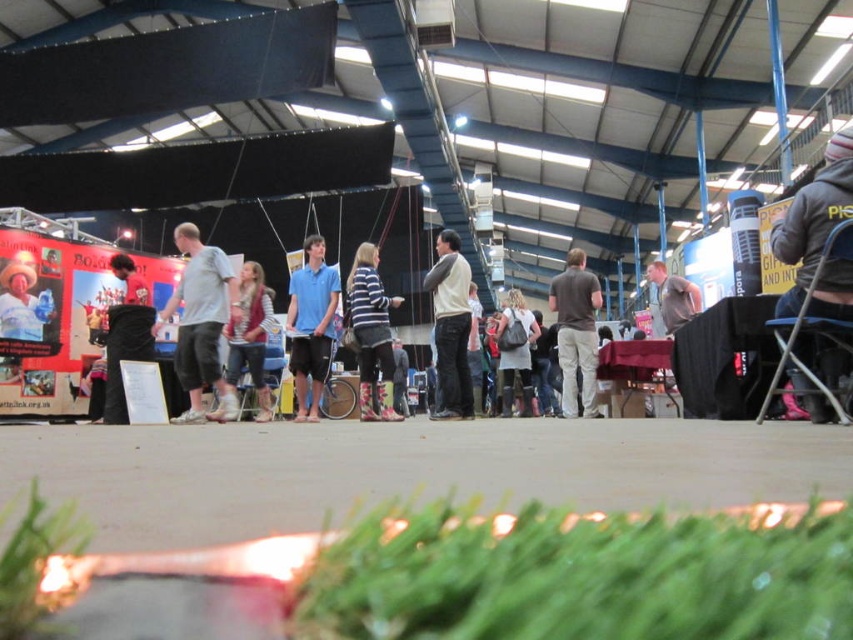
Can you confirm if green fuzzy grass at lower center is positioned to the right of green leafy grass at lower left?

Indeed, green fuzzy grass at lower center is positioned on the right side of green leafy grass at lower left.

Who is shorter, green fuzzy grass at lower center or green leafy grass at lower left?

green fuzzy grass at lower center

Does point (486, 561) lie behind point (47, 557)?

No, it is not.

Locate an element on the screen. green fuzzy grass at lower center is located at coordinates (582, 576).

Which is above, green fuzzy grass at lower center or matte black poster at left?

matte black poster at left is higher up.

Is green fuzzy grass at lower center thinner than matte black poster at left?

Incorrect, green fuzzy grass at lower center's width is not less than matte black poster at left's.

What do you see at coordinates (582, 576) in the screenshot? This screenshot has width=853, height=640. I see `green fuzzy grass at lower center` at bounding box center [582, 576].

What are the coordinates of `green fuzzy grass at lower center` in the screenshot? It's located at (582, 576).

Who is higher up, fluffy beige backpack at center or gray matte shirt at center?

Positioned higher is gray matte shirt at center.

Which of these two, fluffy beige backpack at center or gray matte shirt at center, stands taller?

fluffy beige backpack at center

Find the location of a particular element. fluffy beige backpack at center is located at coordinates (515, 353).